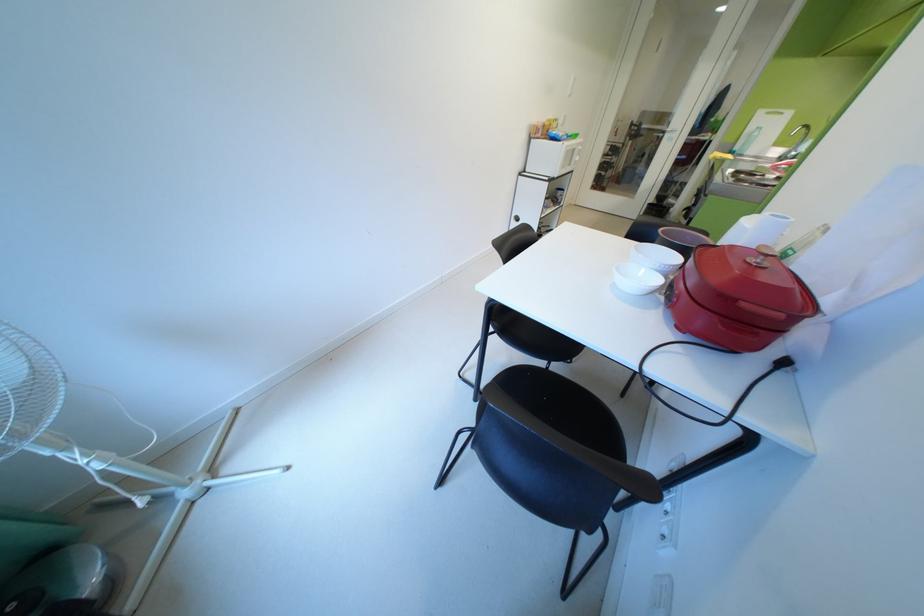
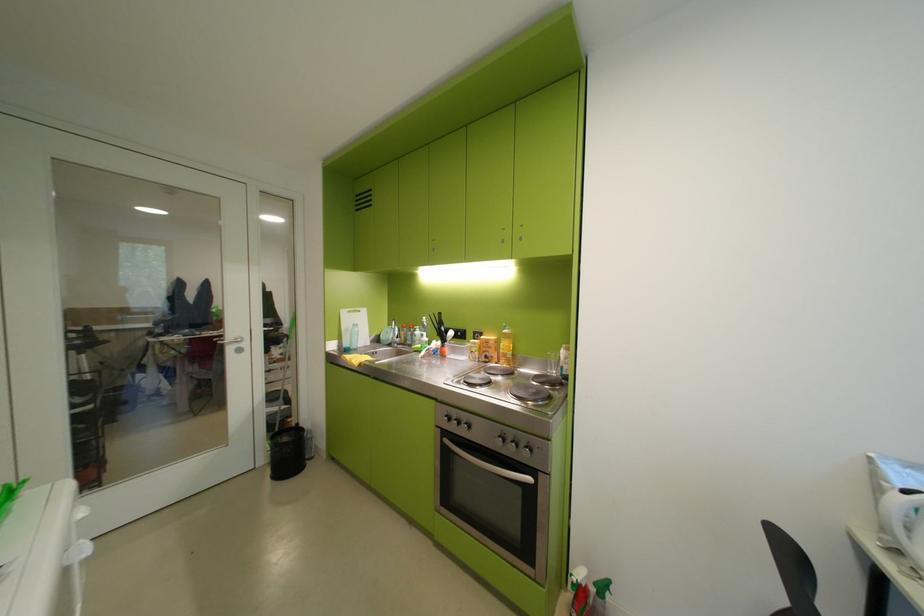
Locate, in the second image, the point that corresponds to point 747,148 in the first image.

(357, 345)